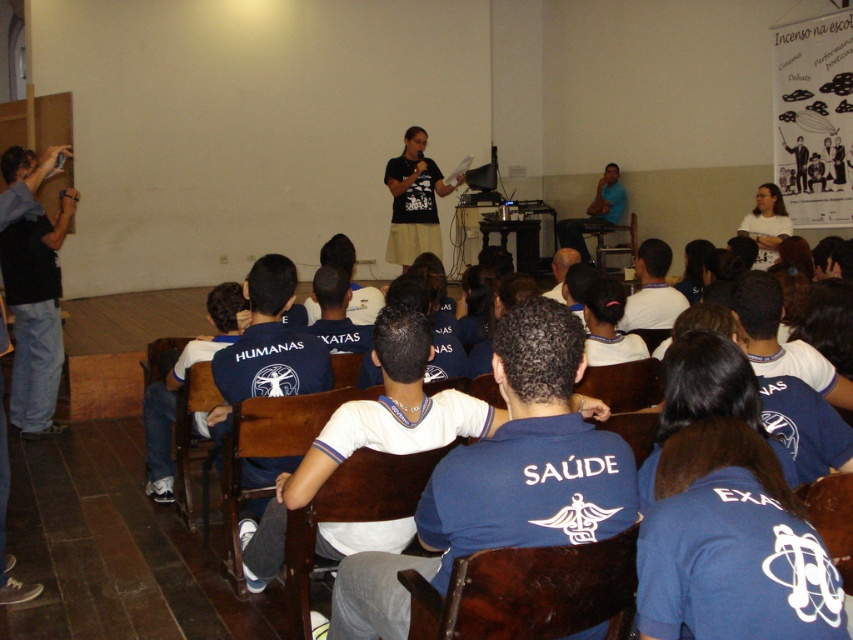
Looking at this image, you are a photographer standing at the back of the room. You want to take a photo that includes both the black jeans at left and the blue shirt at upper center. The camera you are using has a maximum focus range of 20 feet. Will both subjects be in focus?

The distance between the black jeans at left and the blue shirt at upper center is 21.04 feet, which exceeds the camera maximum focus range of 20 feet. Therefore, both subjects cannot be in focus at the same time.

You are an attendee at this event and want to discreetly pass a note to the person wearing the black fabric shirt at center without drawing attention. Since you are sitting on the black jeans at left, which direction should you lean to pass the note?

Since the black jeans at left is positioned on the left side of black fabric shirt at center, you should lean to your right to pass the note to the person wearing the black fabric shirt at center without drawing attention.

You are standing in the room and want to move to a specific point to take a photo. The point is located at coordinates point (413, 220). Considering your height is 1.7 meters, will you be able to reach that point without any obstacles?

The distance of point (413, 220) from viewer is 7.64 meters, so yes, you can reach that point as there is no mention of obstacles in the scene description.